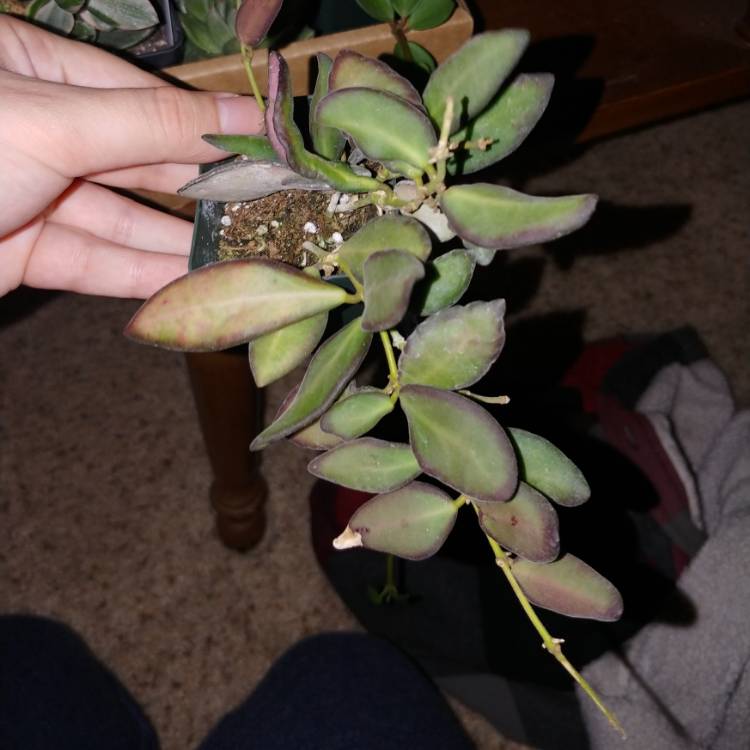
This screenshot has width=750, height=750. What are the coordinates of `plant pot` in the screenshot? It's located at (200, 230).